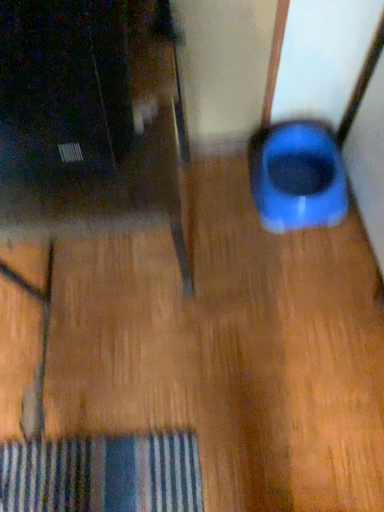
You are a GUI agent. You are given a task and a screenshot of the screen. Output one action in this format:
    pyautogui.click(x=<x>, y=<y>)
    Task: Click on the free space in front of blue glossy toilet at lower right
    The image size is (384, 512).
    Given the screenshot: What is the action you would take?
    pyautogui.click(x=302, y=266)